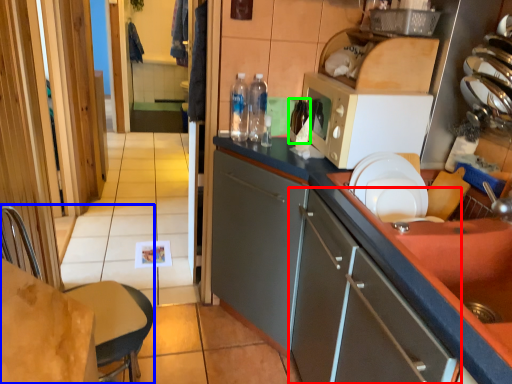
Question: Which object is the farthest from cabinetry (highlighted by a red box)? Choose among these: chair (highlighted by a blue box) or bottle (highlighted by a green box).

Choices:
 (A) chair
 (B) bottle

Answer: (B)